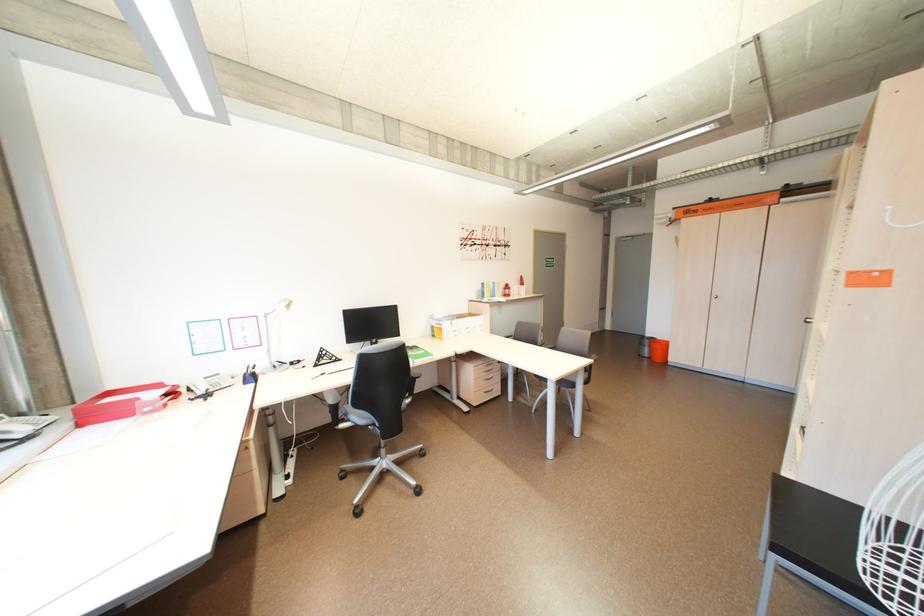
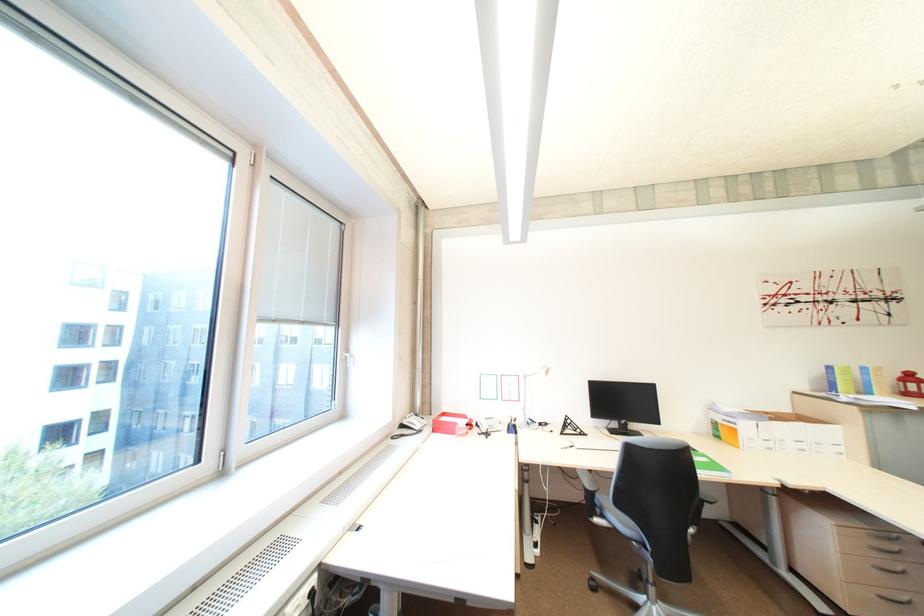
The point at (357, 421) is marked in the first image. Where is the corresponding point in the second image?

(612, 517)